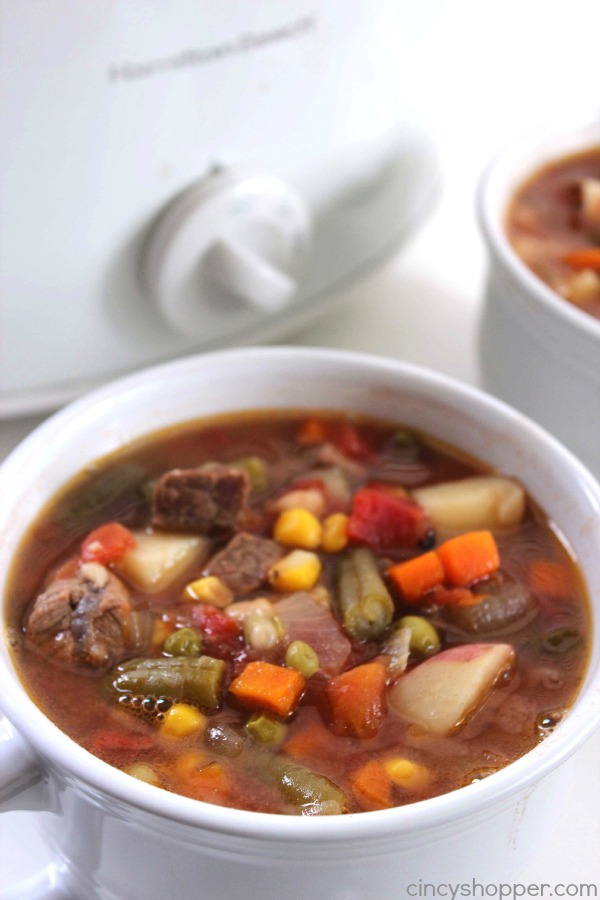
Locate an element on the screen. handle is located at coordinates (18, 770).